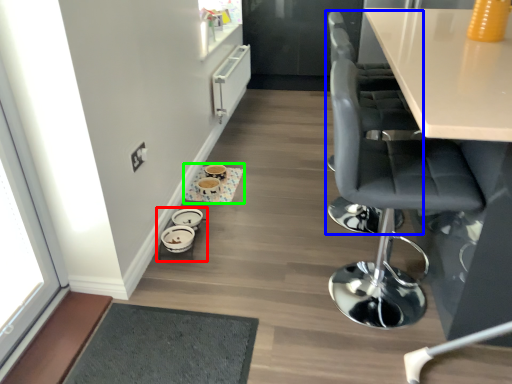
Question: Estimate the real-world distances between objects in this image. Which object is farther from round table (highlighted by a red box), chair (highlighted by a blue box) or round table (highlighted by a green box)?

Choices:
 (A) chair
 (B) round table

Answer: (A)